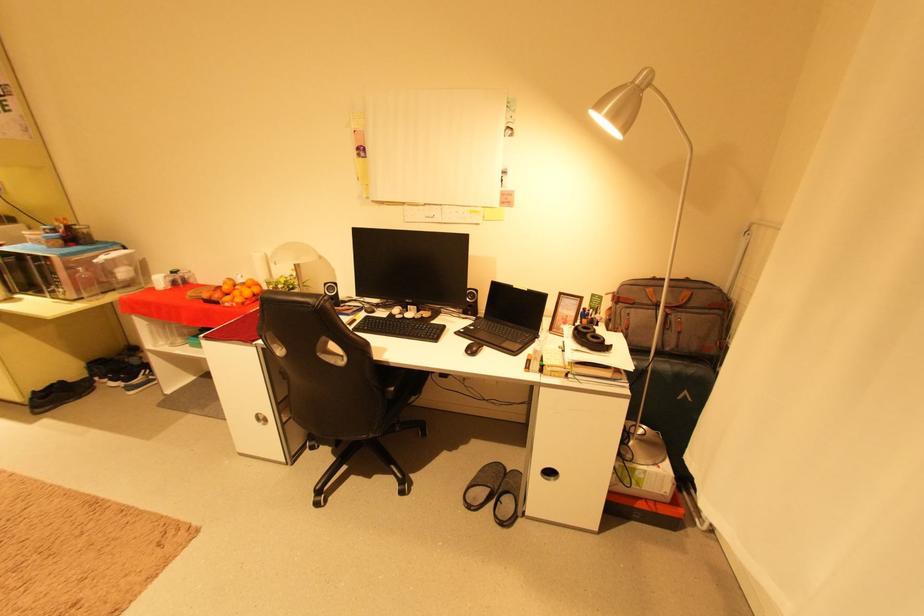
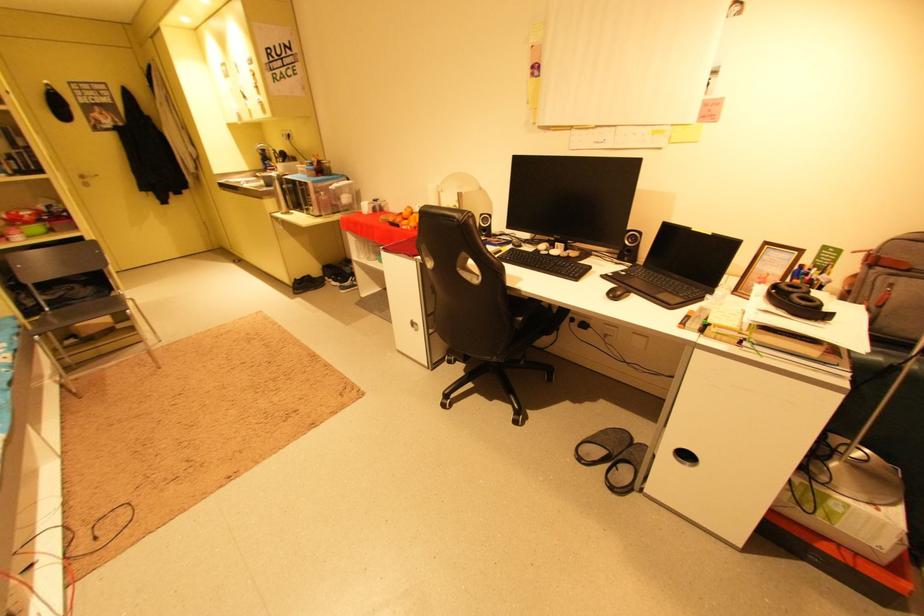
Find the pixel in the second image that matches [572,323] in the first image.

(769, 285)